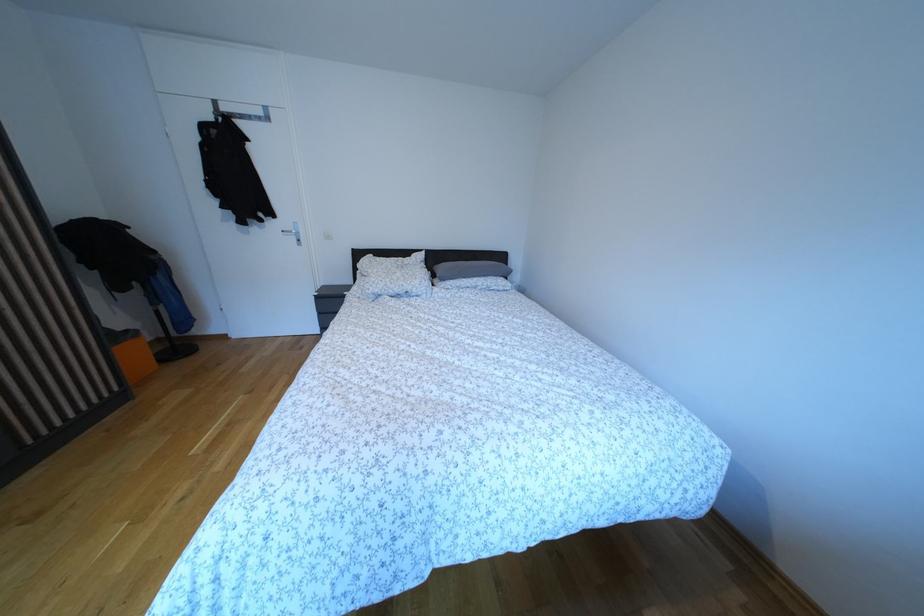
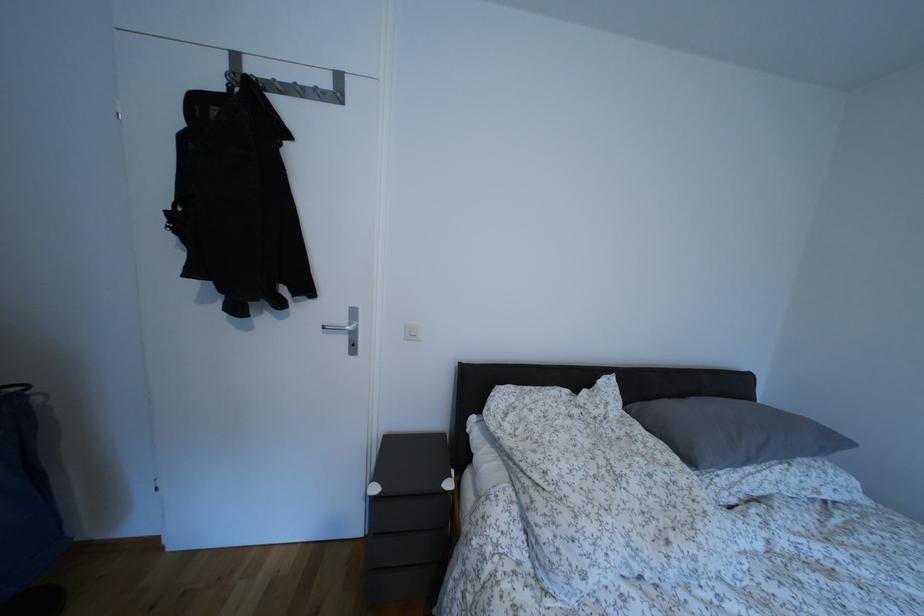
The images are taken continuously from a first-person perspective. In which direction are you moving?

The movement direction of the cameraman is left, forward.